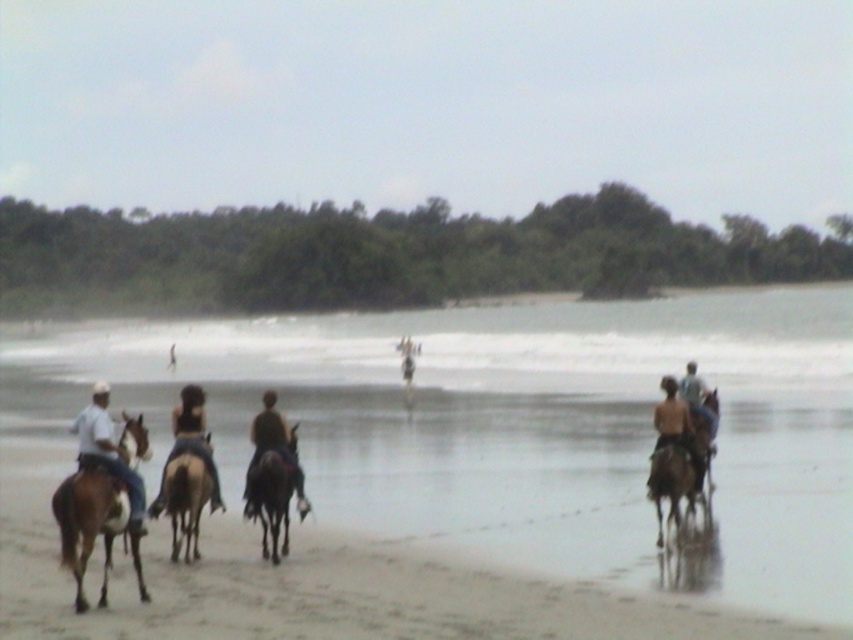
Between point (122, 465) and point (169, 348), which one is positioned in front?

Point (122, 465) is more forward.

Is light brown leather pants at left thinner than brown leather boots at lower left?

Yes, light brown leather pants at left is thinner than brown leather boots at lower left.

Who is more distant from viewer, (134, 502) or (170, 346)?

Positioned behind is point (170, 346).

You are a GUI agent. You are given a task and a screenshot of the screen. Output one action in this format:
    pyautogui.click(x=<x>, y=<y>)
    Task: Click on the light brown leather pants at left
    Image resolution: width=853 pixels, height=640 pixels.
    Given the screenshot: What is the action you would take?
    pyautogui.click(x=108, y=452)

Which of these two, brown glossy horse at left or brown glossy horse at center, stands taller?

brown glossy horse at left

Can you confirm if brown glossy horse at left is positioned above brown glossy horse at center?

Yes, brown glossy horse at left is above brown glossy horse at center.

I want to click on brown glossy horse at left, so click(x=93, y=525).

Can you confirm if brown glossy horse at left is smaller than brown glossy horse at right?

Indeed, brown glossy horse at left has a smaller size compared to brown glossy horse at right.

Does brown glossy horse at left appear over brown glossy horse at right?

Incorrect, brown glossy horse at left is not positioned above brown glossy horse at right.

Locate an element on the screen. The width and height of the screenshot is (853, 640). brown glossy horse at left is located at coordinates (93, 525).